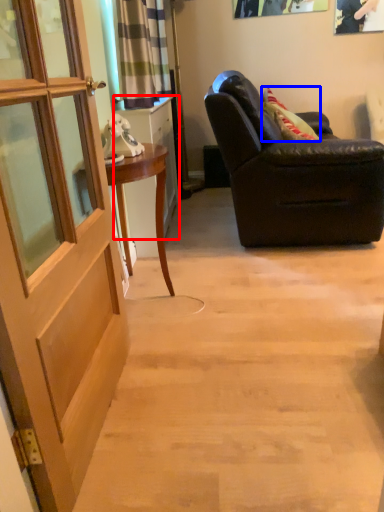
Question: Which point is closer to the camera, cabinetry (highlighted by a red box) or pillow (highlighted by a blue box)?

Choices:
 (A) cabinetry
 (B) pillow

Answer: (A)